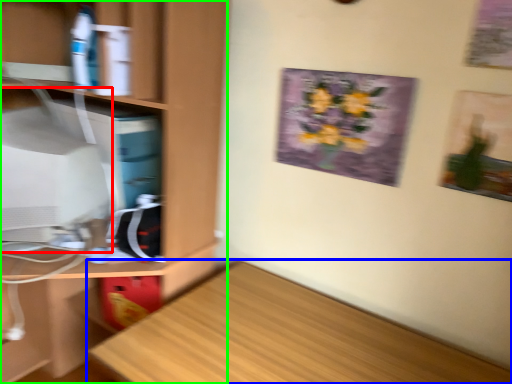
Question: Which object is the closest to the computer monitor (highlighted by a red box)? Choose among these: desk (highlighted by a blue box) or cabinetry (highlighted by a green box).

Choices:
 (A) desk
 (B) cabinetry

Answer: (B)